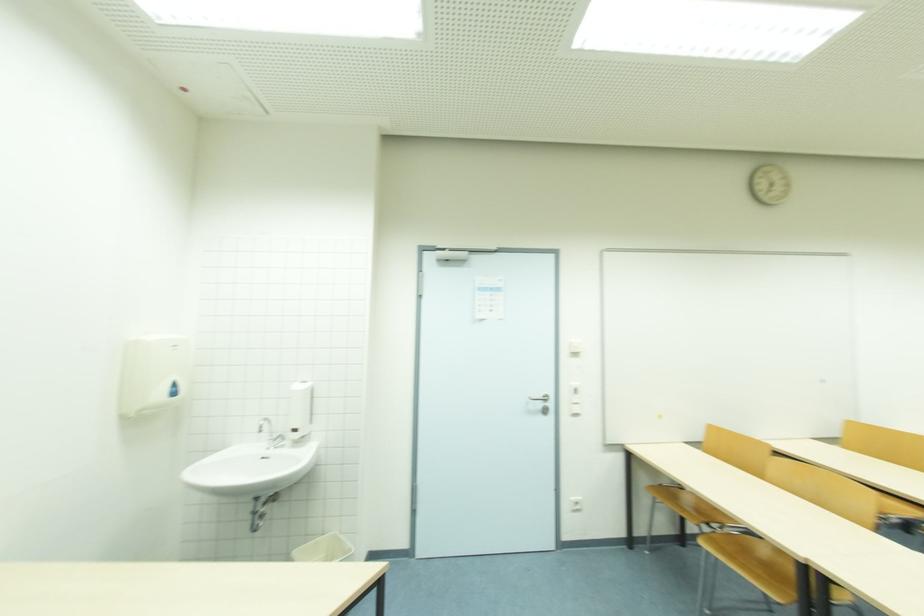
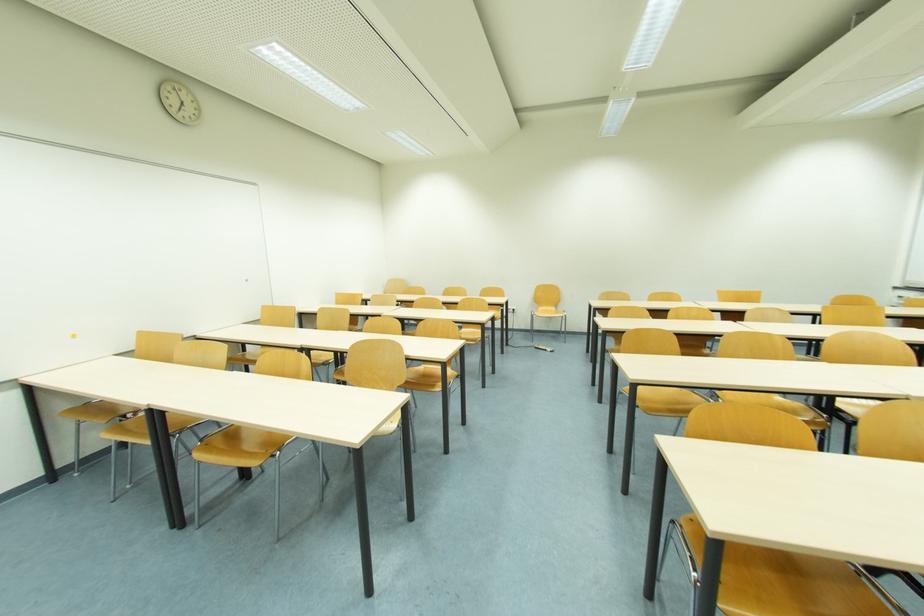
Question: The camera is either moving clockwise (left) or counter-clockwise (right) around the object. The first image is from the beginning of the video and the second image is from the end. Is the camera moving left or right when shooting the video?

Choices:
 (A) Left
 (B) Right

Answer: (A)